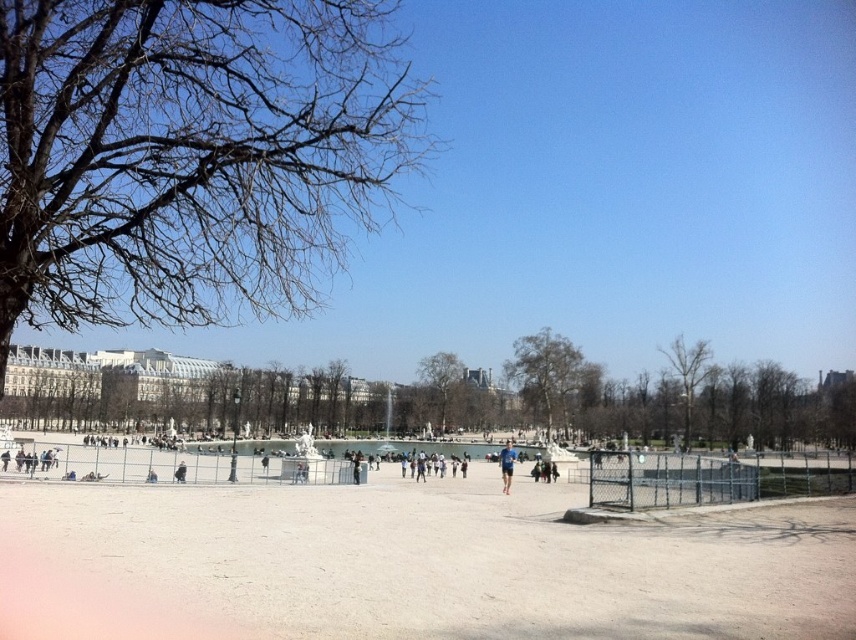
Which is above, green leafy tree at center or blue fabric shirt at center?

Positioned higher is green leafy tree at center.

Is point (525, 403) positioned in front of point (508, 451)?

That is False.

Which is behind, point (577, 372) or point (501, 456)?

Positioned behind is point (577, 372).

At what (x,y) coordinates should I click in order to perform the action: click on green leafy tree at center. Please return your answer as a coordinate pair (x, y). This screenshot has height=640, width=856. Looking at the image, I should click on (547, 376).

Which of these two, bare wood tree at center or blue fabric shirt at center, stands shorter?

Standing shorter between the two is blue fabric shirt at center.

Between point (710, 358) and point (507, 472), which one is positioned behind?

The point (710, 358) is behind.

Between point (681, 376) and point (501, 468), which one is positioned in front?

Point (501, 468) is more forward.

Where is `bare wood tree at center`? bare wood tree at center is located at coordinates (687, 376).

Does bare branches at upper left have a greater height compared to blue fabric shirt at center?

In fact, bare branches at upper left may be shorter than blue fabric shirt at center.

Which is in front, point (48, 109) or point (502, 452)?

Point (48, 109) is in front.

I want to click on bare branches at upper left, so click(x=191, y=154).